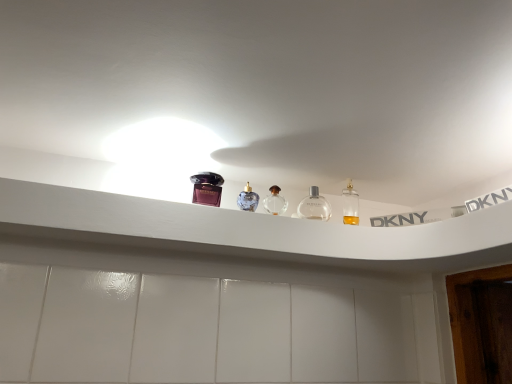
Question: Can you confirm if clear glass perfume at center, which is counted as the second bottle, starting from the right, is positioned to the right of matte purple perfume at upper center?

Choices:
 (A) no
 (B) yes

Answer: (B)

Question: Considering the relative positions of clear glass perfume at center, which is counted as the second bottle, starting from the right, and matte purple perfume at upper center in the image provided, is clear glass perfume at center, which is counted as the second bottle, starting from the right, behind matte purple perfume at upper center?

Choices:
 (A) no
 (B) yes

Answer: (B)

Question: Is clear glass perfume at center, which is counted as the second bottle, starting from the right, not inside matte purple perfume at upper center?

Choices:
 (A) yes
 (B) no

Answer: (A)

Question: Is matte purple perfume at upper center at the back of clear glass perfume at center, the 1th bottle from the left?

Choices:
 (A) no
 (B) yes

Answer: (A)

Question: Does clear glass perfume at center, which is counted as the second bottle, starting from the right, have a greater width compared to matte purple perfume at upper center?

Choices:
 (A) no
 (B) yes

Answer: (A)

Question: Considering the positions of clear glass perfume at center, which is counted as the second bottle, starting from the right, and white plastic shelf at upper center in the image, is clear glass perfume at center, which is counted as the second bottle, starting from the right, taller or shorter than white plastic shelf at upper center?

Choices:
 (A) tall
 (B) short

Answer: (A)

Question: Is clear glass perfume at center, which is counted as the second bottle, starting from the right, inside the boundaries of white plastic shelf at upper center, or outside?

Choices:
 (A) inside
 (B) outside

Answer: (B)

Question: Considering their positions, is clear glass perfume at center, the 1th bottle from the left, located in front of or behind white plastic shelf at upper center?

Choices:
 (A) behind
 (B) front

Answer: (A)

Question: From a real-world perspective, relative to white plastic shelf at upper center, is clear glass perfume at center, which is counted as the second bottle, starting from the right, vertically above or below?

Choices:
 (A) above
 (B) below

Answer: (A)

Question: Is clear glass bottle at center, which is the 1th bottle from right to left, to the left or to the right of clear glass perfume at center, the 1th bottle from the left, in the image?

Choices:
 (A) right
 (B) left

Answer: (A)

Question: From a real-world perspective, is clear glass bottle at center, which is the 1th bottle from right to left, above or below clear glass perfume at center, which is counted as the second bottle, starting from the right?

Choices:
 (A) above
 (B) below

Answer: (B)

Question: Is point (318, 218) closer or farther from the camera than point (281, 213)?

Choices:
 (A) closer
 (B) farther

Answer: (B)

Question: From their relative heights in the image, would you say clear glass bottle at center, acting as the 2th bottle starting from the left, is taller or shorter than clear glass perfume at center, which is counted as the second bottle, starting from the right?

Choices:
 (A) tall
 (B) short

Answer: (B)

Question: Considering the positions of white plastic shelf at upper center and clear glass perfume at center, which is counted as the second bottle, starting from the right, in the image, is white plastic shelf at upper center taller or shorter than clear glass perfume at center, which is counted as the second bottle, starting from the right,?

Choices:
 (A) tall
 (B) short

Answer: (B)

Question: Is white plastic shelf at upper center inside or outside of clear glass perfume at center, which is counted as the second bottle, starting from the right?

Choices:
 (A) inside
 (B) outside

Answer: (B)